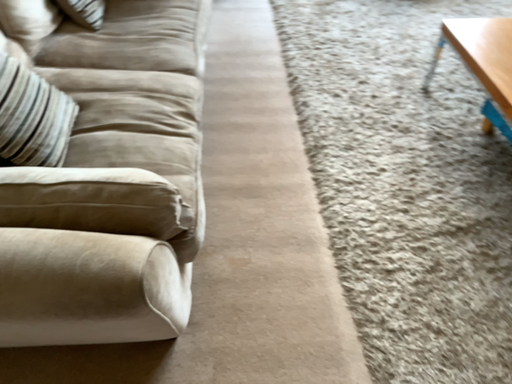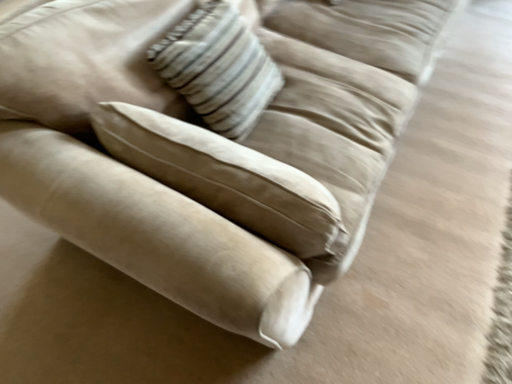
Question: How did the camera likely rotate when shooting the video?

Choices:
 (A) rotated right
 (B) rotated left

Answer: (B)